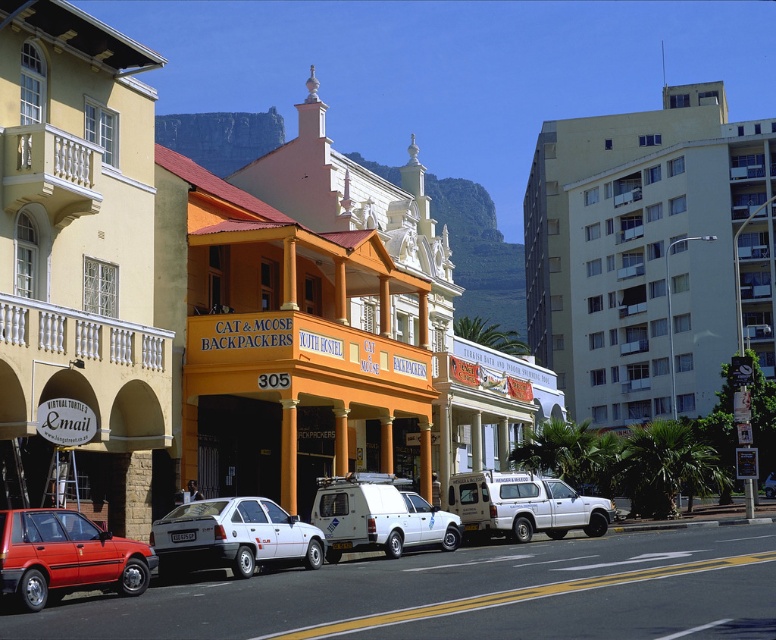
Question: Is matte red hatchback at lower left closer to camera compared to white matte van at center?

Choices:
 (A) no
 (B) yes

Answer: (B)

Question: Which is farther from the yellow painted building at left?

Choices:
 (A) matte red hatchback at lower left
 (B) beige concrete building at right

Answer: (B)

Question: Which of the following is the farthest from the observer?

Choices:
 (A) (582, 234)
 (B) (134, 346)
 (C) (395, 509)
 (D) (30, 541)

Answer: (A)

Question: Which point is closer to the camera?

Choices:
 (A) (341, 513)
 (B) (61, 288)

Answer: (B)

Question: Where is white matte van at center located in relation to white matte suv at center in the image?

Choices:
 (A) right
 (B) left

Answer: (B)

Question: Is beige concrete building at right positioned behind white matte van at center?

Choices:
 (A) yes
 (B) no

Answer: (A)